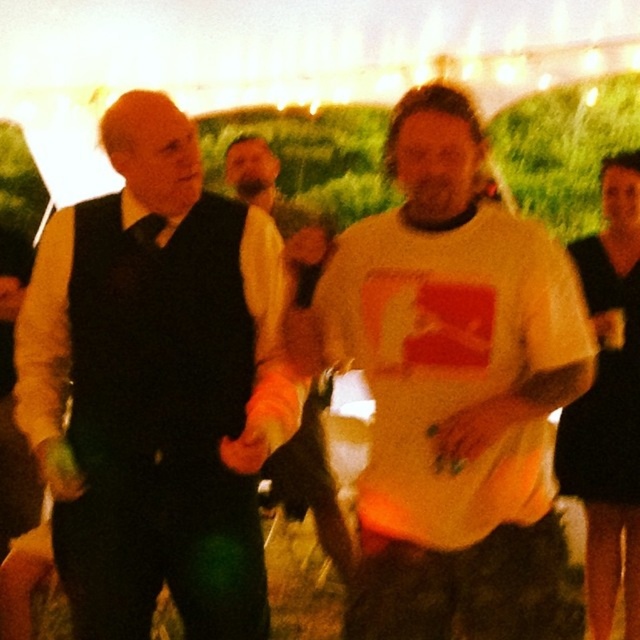
Question: Which point is farther to the camera?

Choices:
 (A) white matte t-shirt at center
 (B) orange fabric shirt at center
 (C) black satin dress at center

Answer: (B)

Question: Can you confirm if white matte t-shirt at center is bigger than black satin dress at center?

Choices:
 (A) no
 (B) yes

Answer: (B)

Question: Is white matte t-shirt at center behind black satin dress at center?

Choices:
 (A) yes
 (B) no

Answer: (B)

Question: Which of the following is the farthest from the observer?

Choices:
 (A) (152, 355)
 (B) (486, 593)
 (C) (310, 291)
 (D) (634, 397)

Answer: (D)

Question: Which of the following is the farthest from the observer?

Choices:
 (A) black satin dress at center
 (B) matte black vest at left
 (C) orange fabric shirt at center
 (D) white matte t-shirt at center

Answer: (C)

Question: Is matte black vest at left to the right of orange fabric shirt at center from the viewer's perspective?

Choices:
 (A) no
 (B) yes

Answer: (A)